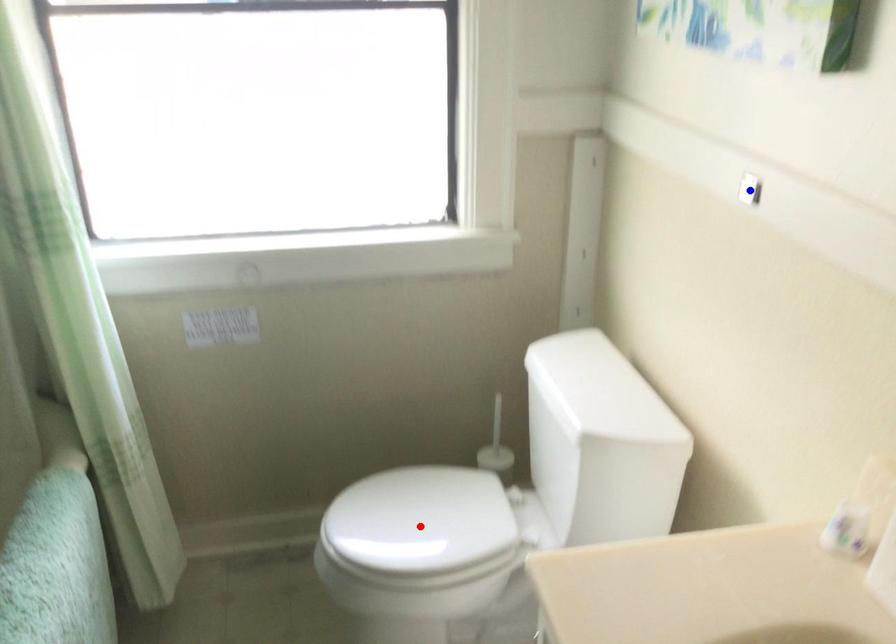
Question: Two points are marked on the image. Which point is closer to the camera?

Choices:
 (A) Blue point is closer.
 (B) Red point is closer.

Answer: (A)